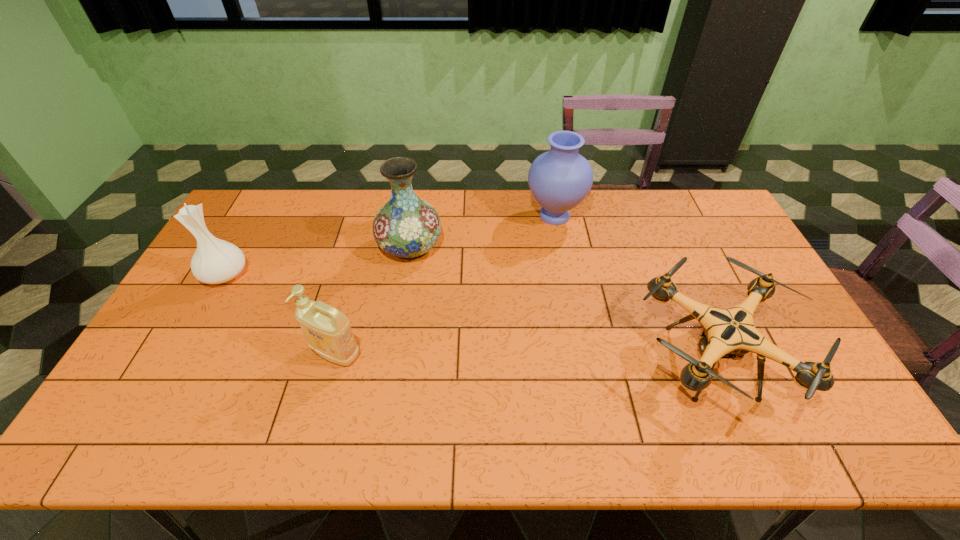
The height and width of the screenshot is (540, 960). I want to click on vacant area situated on the left of the detergent, so click(x=194, y=354).

Find the location of `blank area located 0.250m on the camera mount of the drone`. blank area located 0.250m on the camera mount of the drone is located at coordinates (536, 362).

Image resolution: width=960 pixels, height=540 pixels. I want to click on free point located on the camera mount of the drone, so click(x=516, y=362).

I want to click on vacant space situated on the camera mount of the drone, so click(524, 362).

Locate an element on the screen. Image resolution: width=960 pixels, height=540 pixels. object present at the near edge is located at coordinates (727, 333).

Where is `object located in the left edge section of the desktop`? object located in the left edge section of the desktop is located at coordinates (215, 261).

Find the location of a particular element. Image resolution: width=960 pixels, height=540 pixels. object that is positioned at the right edge is located at coordinates (727, 333).

Image resolution: width=960 pixels, height=540 pixels. What are the coordinates of `object located at the near right corner` in the screenshot? It's located at (727, 333).

Locate an element on the screen. The height and width of the screenshot is (540, 960). free space at the far edge of the desktop is located at coordinates (452, 199).

The image size is (960, 540). I want to click on vacant space at the near edge, so click(415, 450).